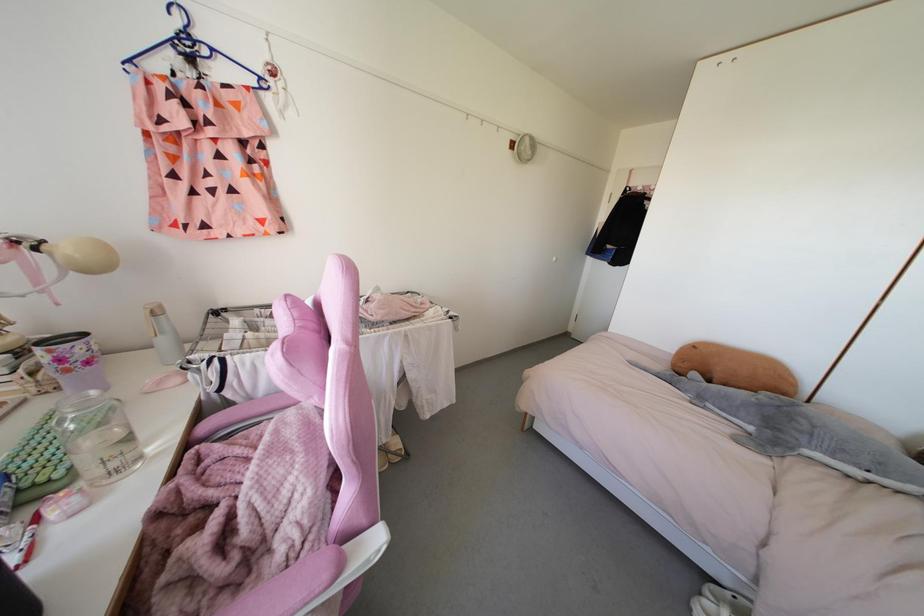
What do you see at coordinates (238, 416) in the screenshot?
I see `the pink chair armrest` at bounding box center [238, 416].